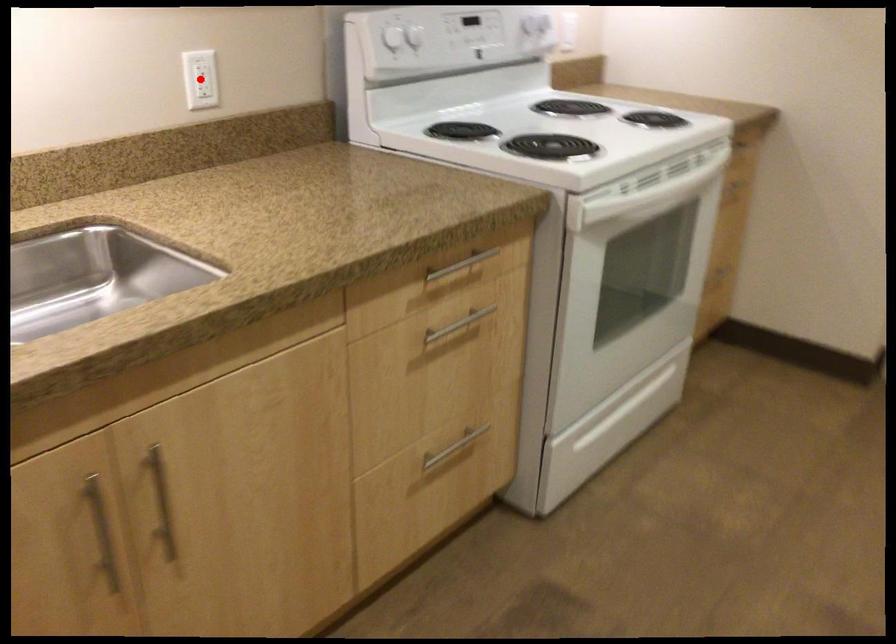
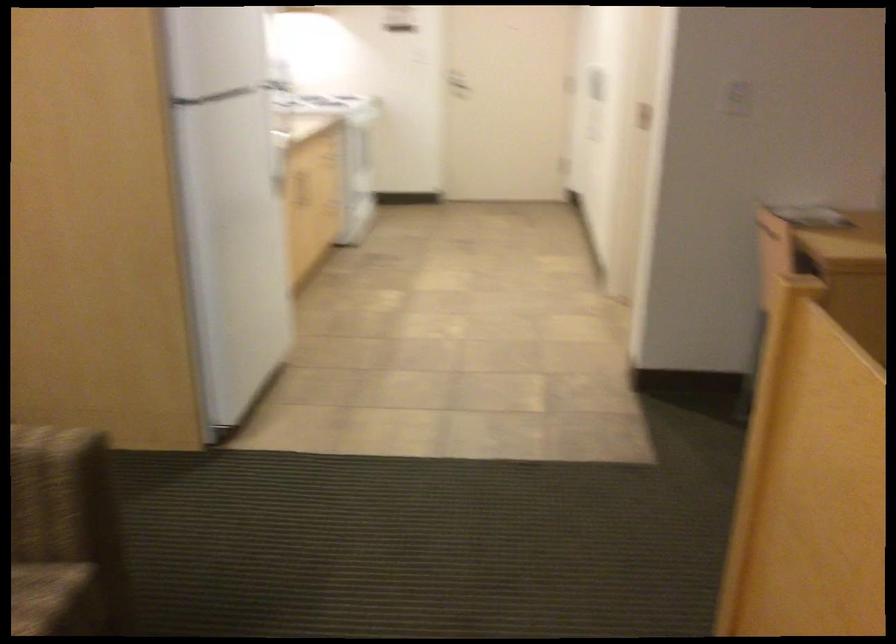
Question: I am providing you with two images of the same scene from different viewpoints. A red point is marked on the first image. Is the red point's position out of view in image 2?

Choices:
 (A) Yes
 (B) No

Answer: (A)